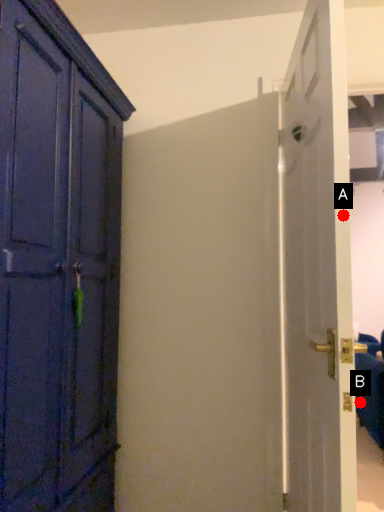
Question: Two points are circled on the image, labeled by A and B beside each circle. Which of the following is the closest to the observer?

Choices:
 (A) A is closer
 (B) B is closer

Answer: (A)